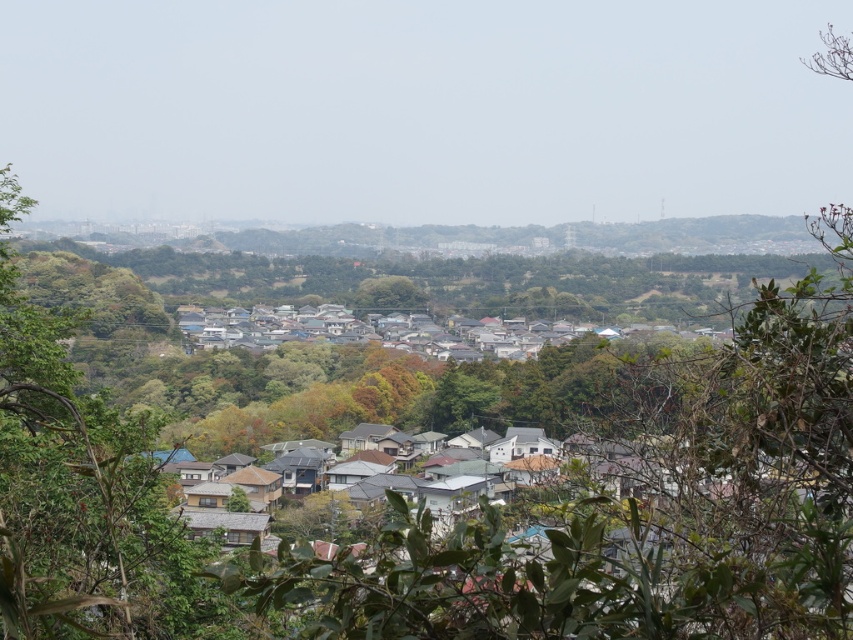
Question: Is green leafy tree at left above green leafy tree at center?

Choices:
 (A) yes
 (B) no

Answer: (B)

Question: Which point is closer to the camera?

Choices:
 (A) (138, 515)
 (B) (402, 276)

Answer: (A)

Question: Is green leafy tree at left below green leafy tree at center?

Choices:
 (A) yes
 (B) no

Answer: (A)

Question: Which point appears farthest from the camera in this image?

Choices:
 (A) (0, 593)
 (B) (358, 300)

Answer: (B)

Question: Which of the following is the farthest from the observer?

Choices:
 (A) (12, 595)
 (B) (399, 301)

Answer: (B)

Question: Can you confirm if green leafy tree at left is thinner than green leafy tree at center?

Choices:
 (A) yes
 (B) no

Answer: (A)